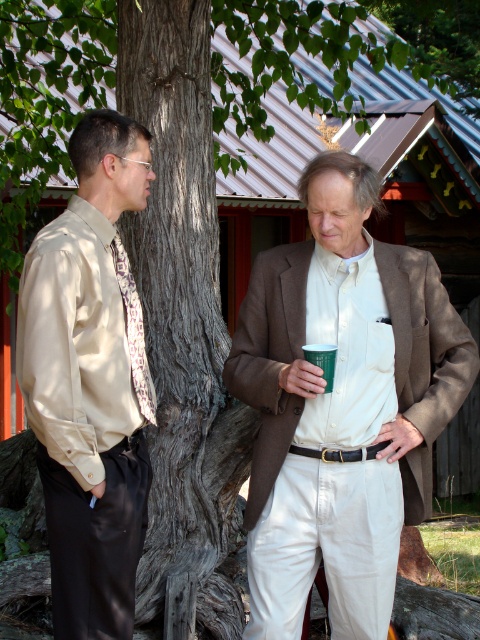
You are standing in the rustic area near the cabin. You see the brown woolen blazer at center and the dark brown textured bark at center. Which object is positioned more to the right side of the scene?

The brown woolen blazer at center is positioned more to the right side of the scene compared to the dark brown textured bark at center.

You are a photographer setting up a shot of the two people in the scene. You want to ensure the matte beige shirt at left and the green paper cup at center are both in frame. Based on their positions, which object is closer to the left edge of the photo?

The matte beige shirt at left is closer to the left edge of the photo because it is positioned to the left of the green paper cup at center.

You are a tailor who needs to determine which garment requires more fabric. You see the brown woolen blazer at center and the matte beige shirt at left. Which garment would need more fabric?

The brown woolen blazer at center requires more fabric because it is bigger than the matte beige shirt at left.